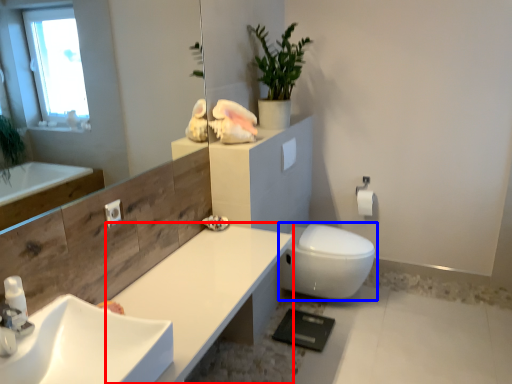
Question: Which object appears farthest to the camera in this image, counter top (highlighted by a red box) or bidet (highlighted by a blue box)?

Choices:
 (A) counter top
 (B) bidet

Answer: (B)